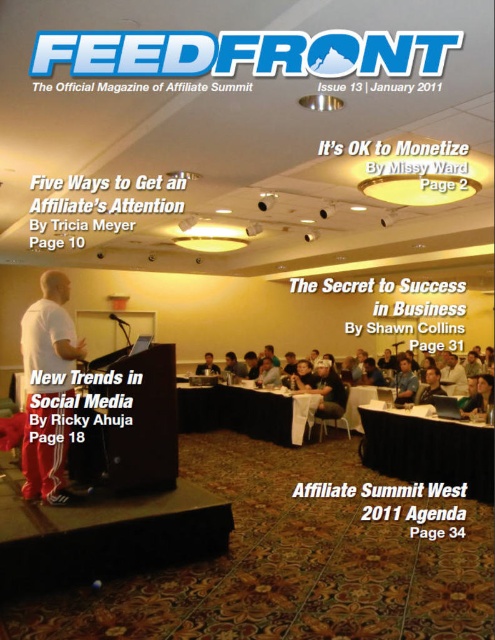
Based on the magazine cover for FeedFront, Issue 13, can you determine which object is wider between the white matte shirt at center and the light brown wooden table at center?

The white matte shirt at center is wider than the light brown wooden table at center according to the description.

Looking at this image, you are organizing a small meeting and need to choose between the black fabric table at center and the light brown wooden table at center. Which table would be more suitable if you require a larger surface area for your materials?

The black fabric table at center has a larger size compared to the light brown wooden table at center, so it would be more suitable for requiring a larger surface area for materials.

You are an attendee at the Affiliate Summit conference. You notice the speaker wearing a white matte shirt at center and a light brown wooden table at center. Which object is closer to you from your seated position in the audience?

The white matte shirt at center is closer to you because it is in front of the light brown wooden table at center.